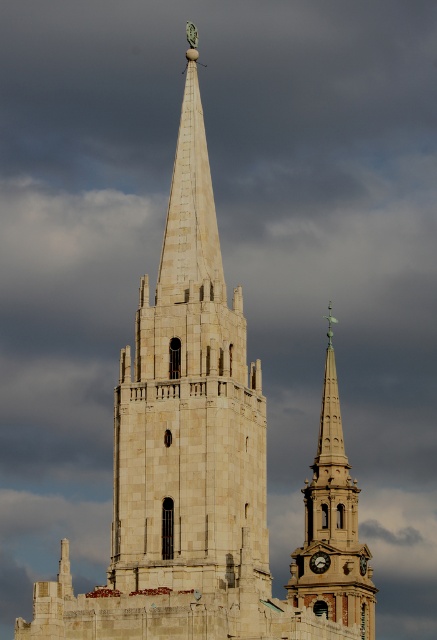
Question: Which point appears farthest from the camera in this image?

Choices:
 (A) (144, 464)
 (B) (343, 531)
 (C) (319, 561)

Answer: (B)

Question: Is white stone steeple at center positioned behind smooth stone spire at center?

Choices:
 (A) yes
 (B) no

Answer: (B)

Question: Which point appears closest to the camera in this image?

Choices:
 (A) (114, 586)
 (B) (322, 561)
 (C) (335, 452)

Answer: (A)

Question: Is white stone steeple at center positioned behind smooth stone spire at center?

Choices:
 (A) yes
 (B) no

Answer: (B)

Question: Which object appears closest to the camera in this image?

Choices:
 (A) white stone steeple at center
 (B) smooth stone spire at center

Answer: (A)

Question: Where is smooth stone spire at center located in relation to gold metallic clock at center in the image?

Choices:
 (A) above
 (B) below

Answer: (A)